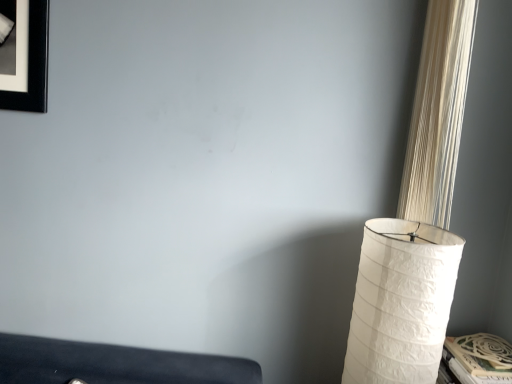
Question: From a real-world perspective, is white textured curtain at right physically located above or below white textured lampshade at right?

Choices:
 (A) below
 (B) above

Answer: (B)

Question: Do you think white textured curtain at right is within white textured lampshade at right, or outside of it?

Choices:
 (A) outside
 (B) inside

Answer: (A)

Question: Is point (431, 74) positioned closer to the camera than point (422, 284)?

Choices:
 (A) farther
 (B) closer

Answer: (A)

Question: In terms of height, does white textured lampshade at right look taller or shorter compared to white textured curtain at right?

Choices:
 (A) short
 (B) tall

Answer: (A)

Question: Based on their sizes in the image, would you say white textured lampshade at right is bigger or smaller than white textured curtain at right?

Choices:
 (A) big
 (B) small

Answer: (A)

Question: In terms of width, does white textured lampshade at right look wider or thinner when compared to white textured curtain at right?

Choices:
 (A) thin
 (B) wide

Answer: (B)

Question: From a real-world perspective, is white textured lampshade at right above or below white textured curtain at right?

Choices:
 (A) above
 (B) below

Answer: (B)